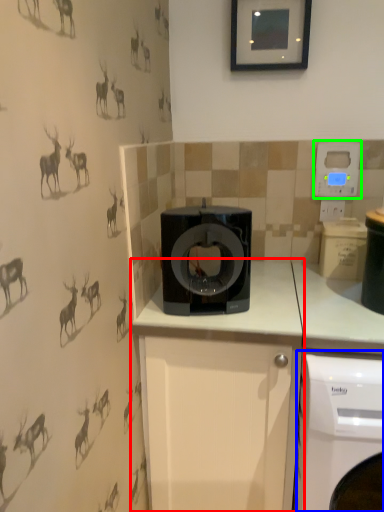
Question: Which object is the closest to the cabinetry (highlighted by a red box)? Choose among these: washing machine (highlighted by a blue box) or thermostat (highlighted by a green box).

Choices:
 (A) washing machine
 (B) thermostat

Answer: (A)